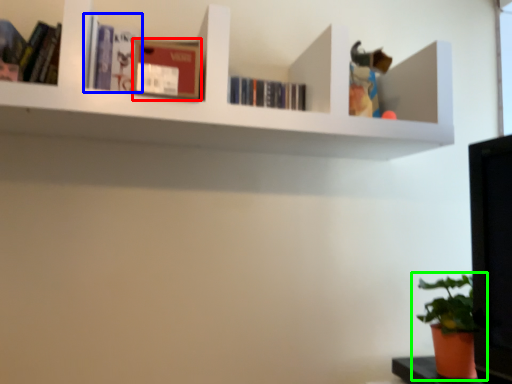
Question: Which object is positioned farthest from paperback book (highlighted by a red box)? Select from book (highlighted by a blue box) and houseplant (highlighted by a green box).

Choices:
 (A) book
 (B) houseplant

Answer: (B)